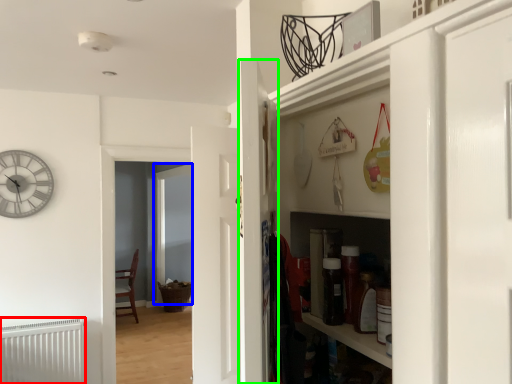
Question: Which object is the closest to the radiator (highlighted by a red box)? Choose among these: glass door (highlighted by a blue box) or door (highlighted by a green box).

Choices:
 (A) glass door
 (B) door

Answer: (B)